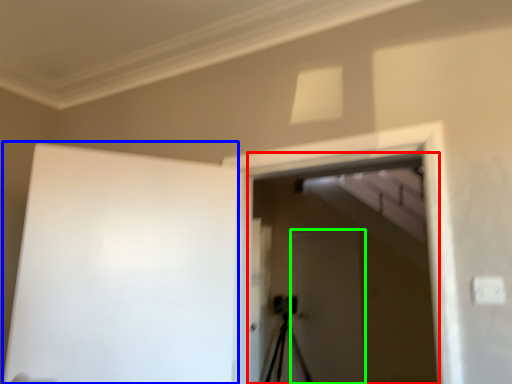
Question: Which is farther away from screen door (highlighted by a red box)? barn door (highlighted by a blue box) or screen door (highlighted by a green box)?

Choices:
 (A) barn door
 (B) screen door

Answer: (A)